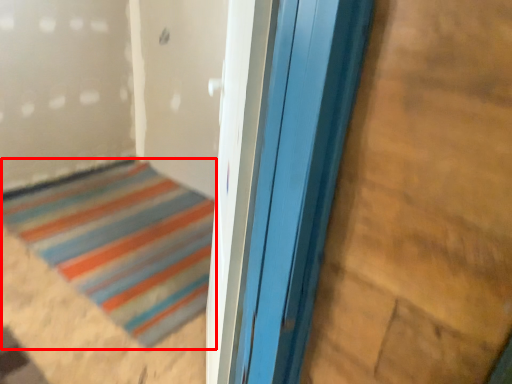
Question: From the image, what is the correct spatial relationship of door (annotated by the red box) in relation to plywood?

Choices:
 (A) right
 (B) left

Answer: (B)